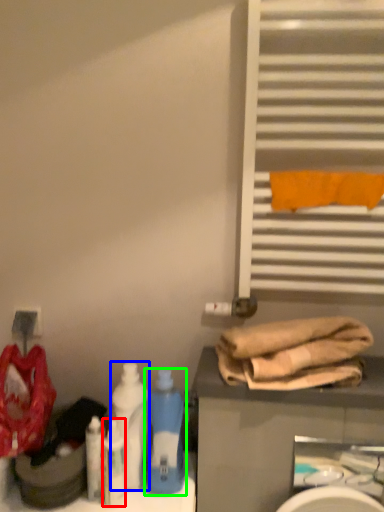
Question: Which object is positioned farthest from cleaning product (highlighted by a red box)? Select from bottle (highlighted by a blue box) and bottle (highlighted by a green box).

Choices:
 (A) bottle
 (B) bottle

Answer: (B)